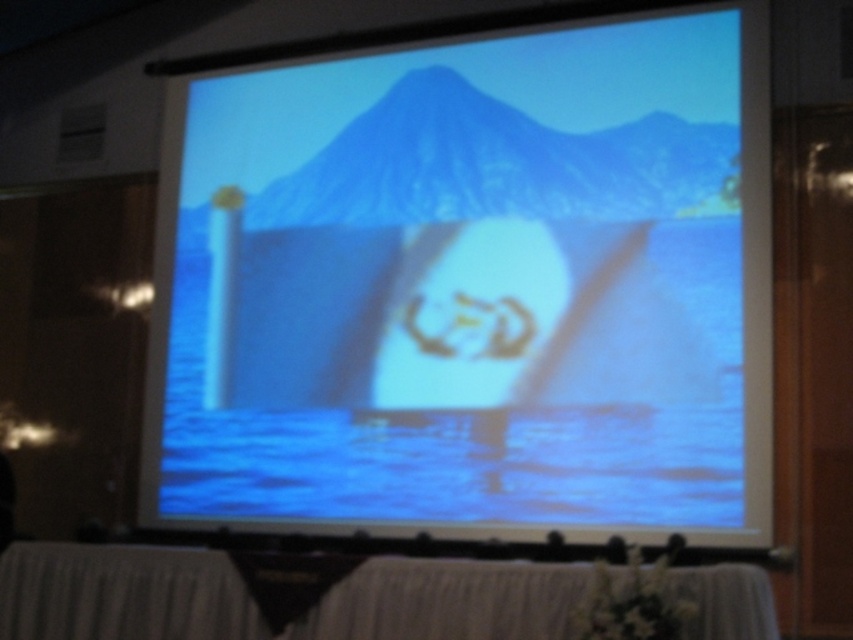
Question: Is white matte projection screen at center below white cloth at lower center?

Choices:
 (A) yes
 (B) no

Answer: (B)

Question: Among these points, which one is farthest from the camera?

Choices:
 (A) (461, 564)
 (B) (373, 154)

Answer: (B)

Question: Which point is farther from the camera taking this photo?

Choices:
 (A) (231, 570)
 (B) (654, 76)

Answer: (B)

Question: Is white matte projection screen at center to the right of white cloth at lower center from the viewer's perspective?

Choices:
 (A) no
 (B) yes

Answer: (B)

Question: Which point is farther to the camera?

Choices:
 (A) white matte projection screen at center
 (B) white cloth at lower center

Answer: (A)

Question: Can you confirm if white matte projection screen at center is bigger than white cloth at lower center?

Choices:
 (A) no
 (B) yes

Answer: (B)